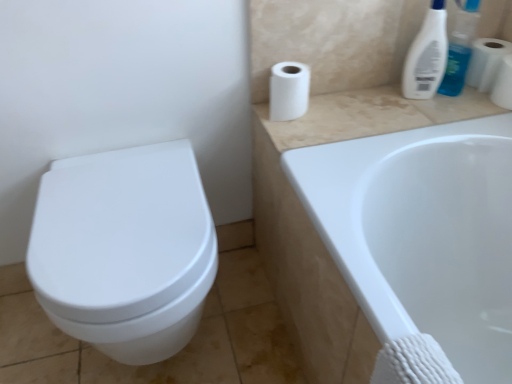
Question: Looking at their shapes, would you say beige marble counter top at upper right is wider or thinner than white matte toilet paper at upper right, the first toilet paper viewed from the right?

Choices:
 (A) wide
 (B) thin

Answer: (A)

Question: Is beige marble counter top at upper right spatially inside white matte toilet paper at upper right, the first toilet paper viewed from the right, or outside of it?

Choices:
 (A) outside
 (B) inside

Answer: (A)

Question: Which object is the closest to the white matte toilet paper at upper right, acting as the 3th toilet paper starting from the right?

Choices:
 (A) beige marble counter top at upper right
 (B) white matte toilet paper at upper right, the first toilet paper viewed from the right
 (C) white matte toilet paper at upper right, which ranks as the 2th toilet paper in right-to-left order
 (D) white glossy toilet at left
 (E) white glossy bottle at upper right

Answer: (A)

Question: Based on their relative distances, which object is nearer to the white matte toilet paper at upper right, acting as the 3th toilet paper starting from the right?

Choices:
 (A) white matte toilet paper at upper right, which ranks as the 2th toilet paper in right-to-left order
 (B) white matte toilet paper at upper right, the first toilet paper viewed from the right
 (C) white glossy toilet at left
 (D) beige marble counter top at upper right
 (E) white glossy bottle at upper right

Answer: (D)